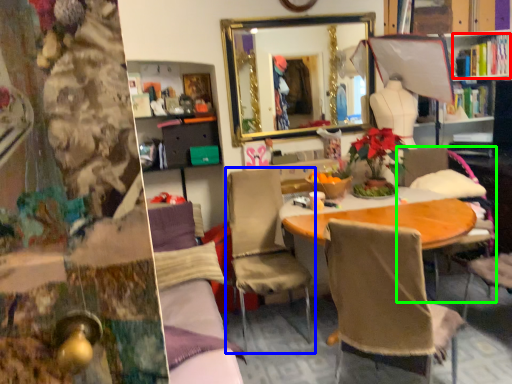
Question: Estimate the real-world distances between objects in this image. Which object is closer to book (highlighted by a red box), chair (highlighted by a blue box) or chair (highlighted by a green box)?

Choices:
 (A) chair
 (B) chair

Answer: (B)